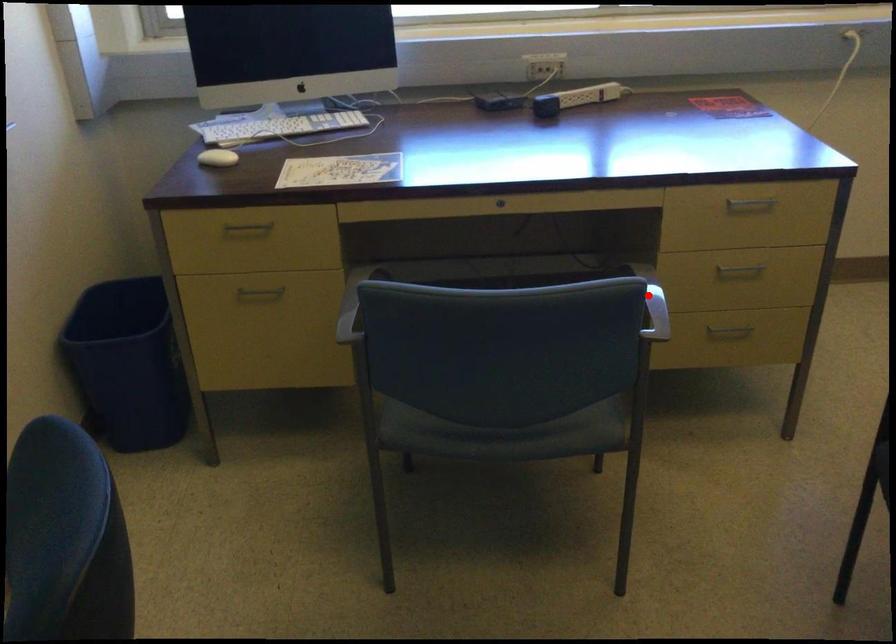
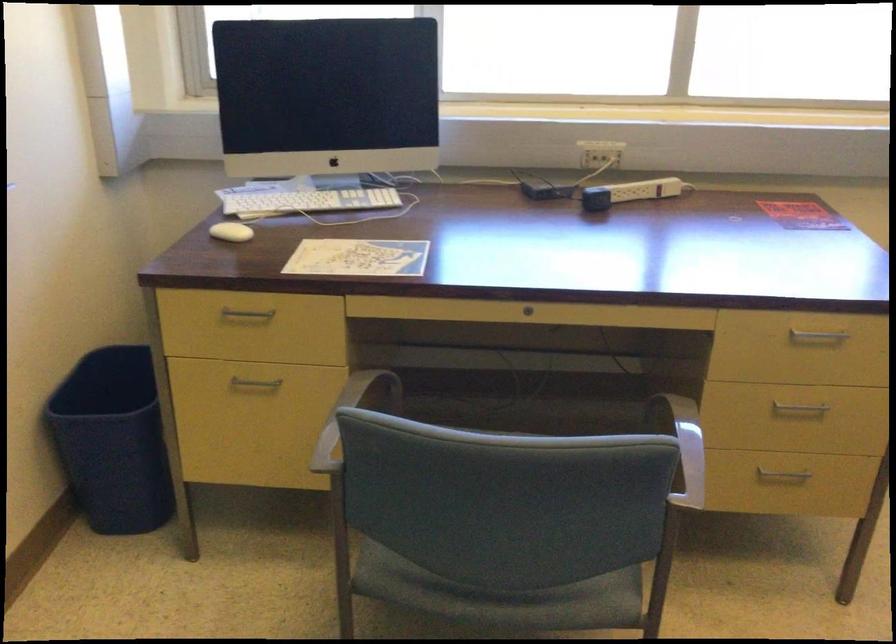
Question: A red point is marked in image1. In image2, is the corresponding 3D point closer to the camera or farther? Reply with the corresponding letter.

Choices:
 (A) The corresponding 3D point is closer.
 (B) The corresponding 3D point is farther.

Answer: (A)